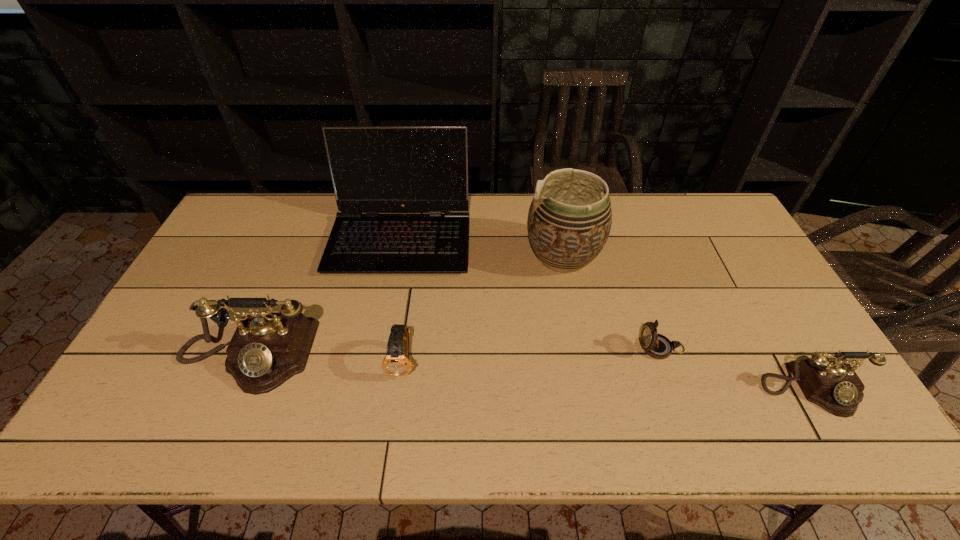
Identify the location of vacant position at the far edge of the desktop. Image resolution: width=960 pixels, height=540 pixels. (326, 235).

The height and width of the screenshot is (540, 960). Find the location of `vacant space at the near edge of the desktop`. vacant space at the near edge of the desktop is located at coordinates (575, 389).

In the image, there is a desktop. Where is `vacant space at the left edge`? The width and height of the screenshot is (960, 540). vacant space at the left edge is located at coordinates (160, 362).

Where is `vacant space at the right edge`? The image size is (960, 540). vacant space at the right edge is located at coordinates (783, 316).

Image resolution: width=960 pixels, height=540 pixels. In the image, there is a desktop. Find the location of `blank space at the far left corner`. blank space at the far left corner is located at coordinates (257, 210).

In the image, there is a desktop. Where is `vacant region at the near left corner`? The width and height of the screenshot is (960, 540). vacant region at the near left corner is located at coordinates (171, 390).

Locate an element on the screen. Image resolution: width=960 pixels, height=540 pixels. free space at the far right corner is located at coordinates (701, 225).

Locate an element on the screen. The height and width of the screenshot is (540, 960). free space between the third tallest object and the laptop computer is located at coordinates (324, 297).

What are the coordinates of `free space between the second object from right to left and the watch` in the screenshot? It's located at pos(533,355).

Locate an element on the screen. empty location between the laptop computer and the third tallest object is located at coordinates (324, 297).